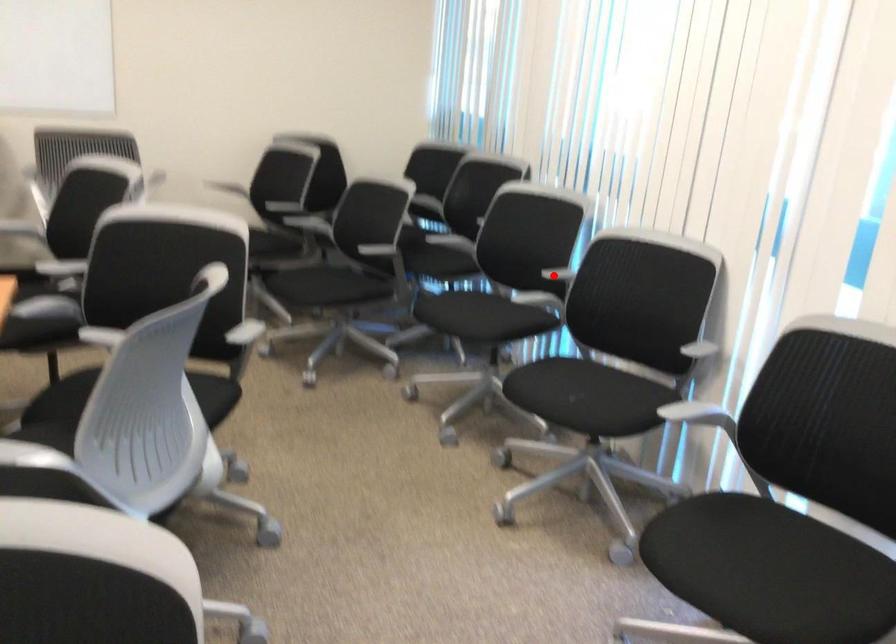
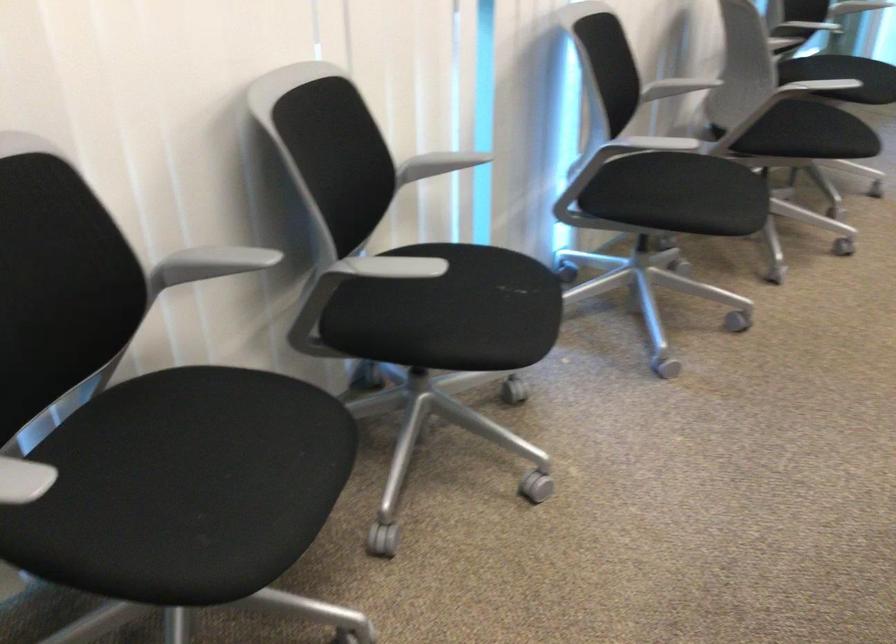
Locate, in the second image, the point that corresponds to the highlighted location in the first image.

(211, 263)